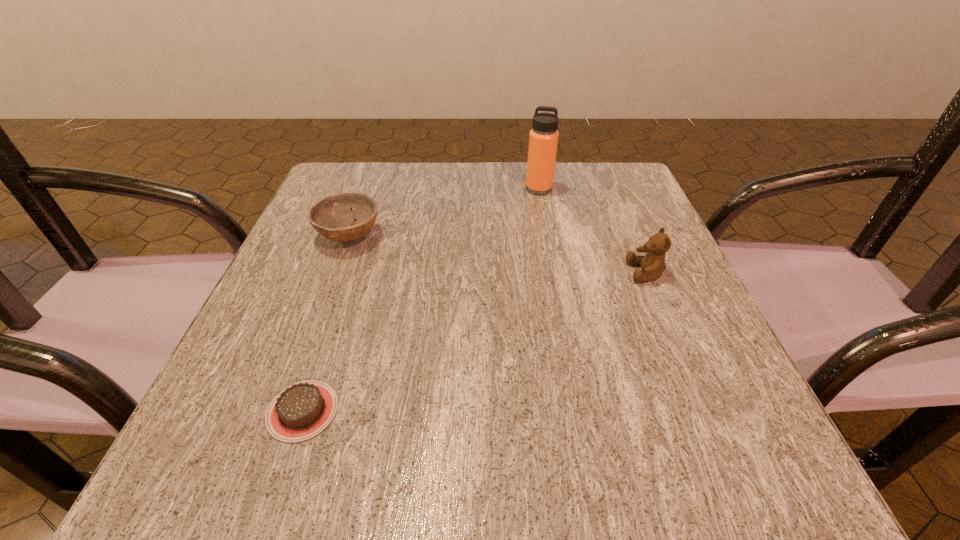
Locate an element on the screen. This screenshot has width=960, height=540. free space in the image that satisfies the following two spatial constraints: 1. on the back side of the thermos bottle; 2. on the left side of the third tallest object is located at coordinates (367, 189).